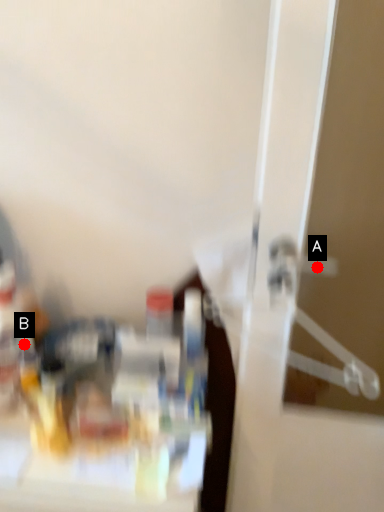
Question: Two points are circled on the image, labeled by A and B beside each circle. Which point is farther to the camera?

Choices:
 (A) A is further
 (B) B is further

Answer: (B)